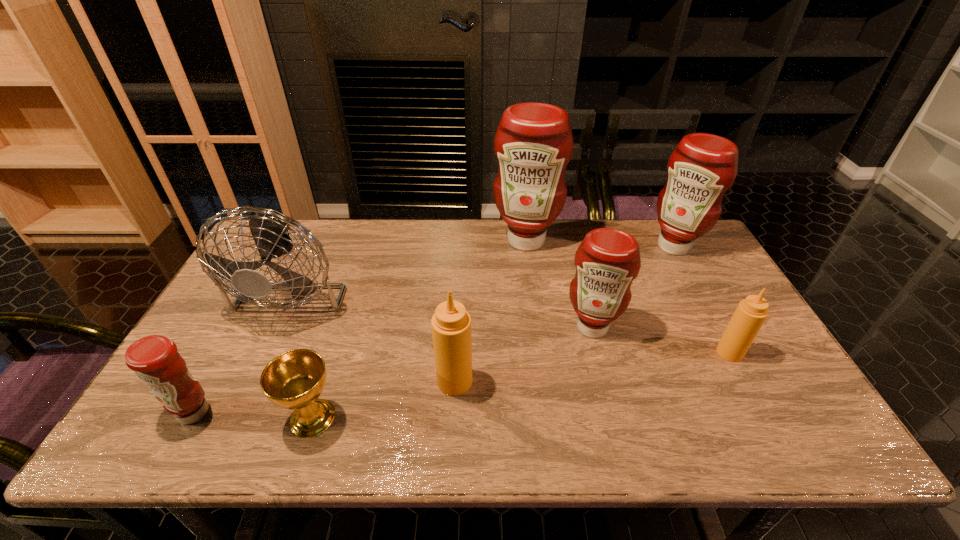
You are a GUI agent. You are given a task and a screenshot of the screen. Output one action in this format:
    pyautogui.click(x=<x>, y=<y>)
    Task: Click on the biggest red condiment
    This screenshot has height=540, width=960.
    Given the screenshot: What is the action you would take?
    pyautogui.click(x=533, y=144)

I want to click on the tallest object, so click(533, 144).

Find the location of a particular element. This screenshot has height=540, width=960. the fifth shortest condiment is located at coordinates (701, 169).

The height and width of the screenshot is (540, 960). Find the location of `the rightmost red condiment`. the rightmost red condiment is located at coordinates (701, 169).

The image size is (960, 540). Identify the location of fan. (269, 233).

Image resolution: width=960 pixels, height=540 pixels. I want to click on the second condiment from left to right, so [x=451, y=324].

Where is `the left tan condiment`? the left tan condiment is located at coordinates (451, 324).

Locate an element on the screen. the third farthest condiment is located at coordinates 607,261.

Identify the location of the third farthest red condiment. (607, 261).

Locate an element on the screen. the fourth nearest object is located at coordinates (750, 314).